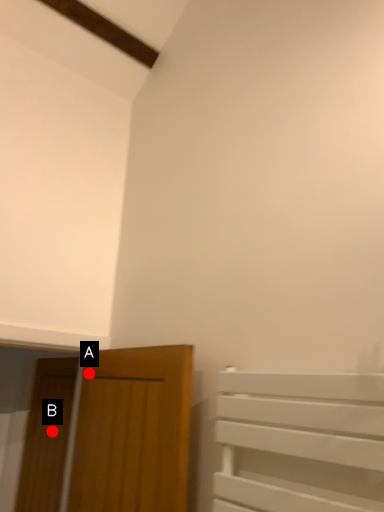
Question: Two points are circled on the image, labeled by A and B beside each circle. Which point appears closest to the camera in this image?

Choices:
 (A) A is closer
 (B) B is closer

Answer: (A)